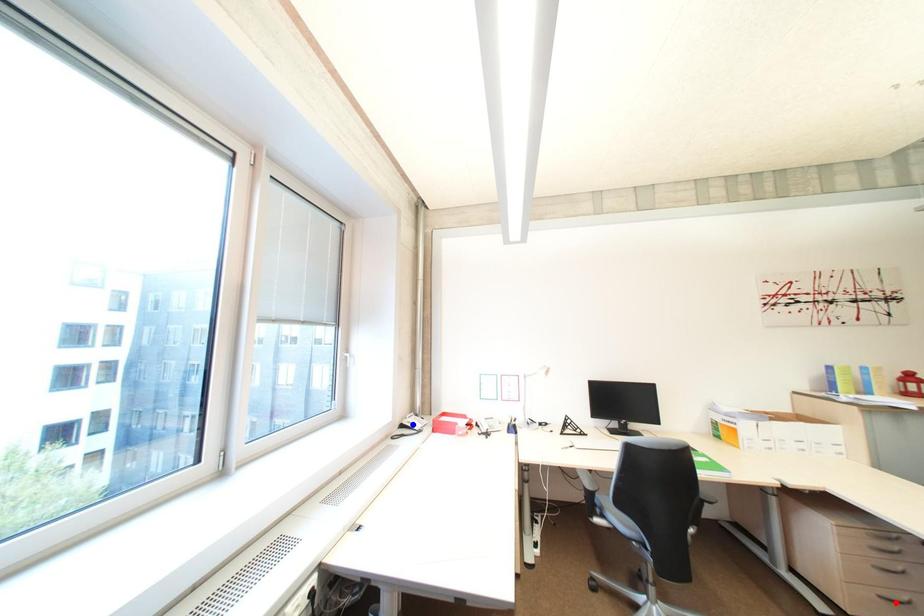
Question: In the image, two points are highlighted. Which point is nearer to the camera? Reply with the corresponding letter.

Choices:
 (A) blue point
 (B) red point

Answer: (B)